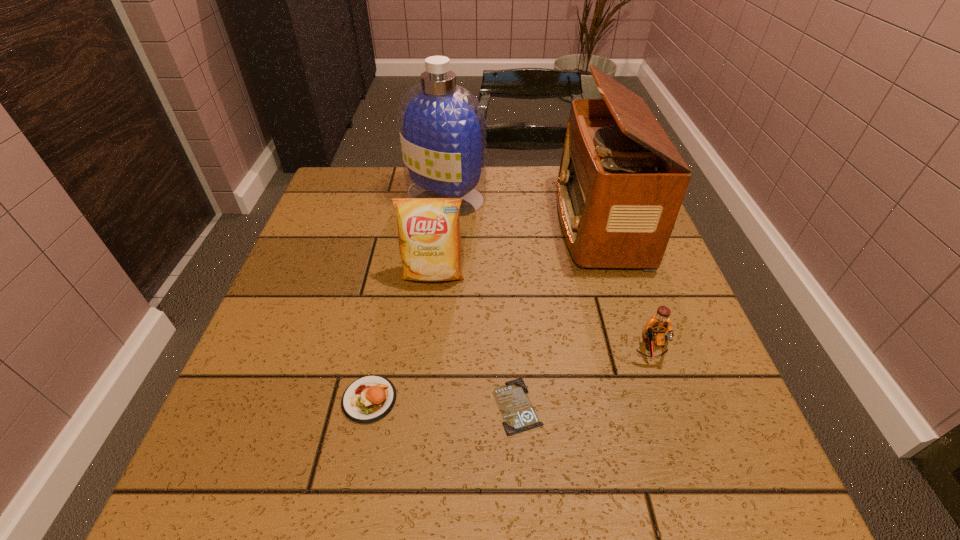
This screenshot has width=960, height=540. What are the coordinates of `vacant space that's between the Lego and the crisp (potato chip)` in the screenshot? It's located at (542, 312).

Identify the location of blank region between the Lego and the fourth object from left to right. (584, 377).

Where is `vacant point located between the radio receiver and the shortest object`? This screenshot has height=540, width=960. vacant point located between the radio receiver and the shortest object is located at coordinates (558, 314).

Find the location of a particular element. This screenshot has height=540, width=960. free area in between the patty (food) and the shortest object is located at coordinates (444, 402).

Locate an element on the screen. free point between the crisp (potato chip) and the third nearest object is located at coordinates (542, 312).

The width and height of the screenshot is (960, 540). What are the coordinates of `unoccupied area between the radio receiver and the identity card` in the screenshot? It's located at (558, 314).

You are a GUI agent. You are given a task and a screenshot of the screen. Output one action in this format:
    pyautogui.click(x=<x>, y=<y>)
    Task: Click on the empty space between the fourth tallest object and the radio receiver
    The width and height of the screenshot is (960, 540).
    Given the screenshot: What is the action you would take?
    pyautogui.click(x=625, y=285)

Identify which object is the second nearest to the patty (food). Please provide its 2D coordinates. Your answer should be formatted as a tuple, i.e. [(x, y)], where the tuple contains the x and y coordinates of a point satisfying the conditions above.

[(429, 236)]

The width and height of the screenshot is (960, 540). What are the coordinates of `object that stands as the third closest to the identity card` in the screenshot? It's located at (429, 236).